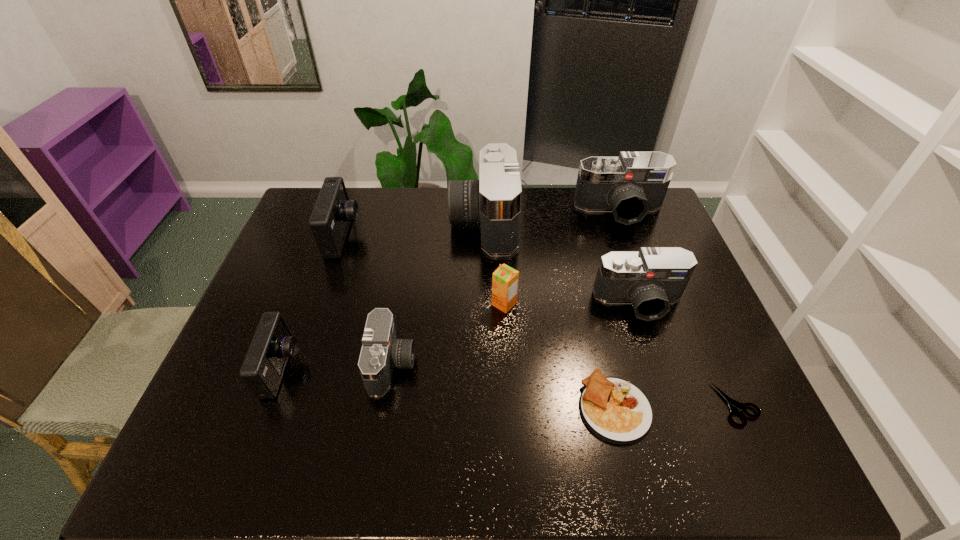
Locate an element on the screen. vacant region located 0.110m on the front-facing side of the fourth camera from right to left is located at coordinates (459, 364).

Image resolution: width=960 pixels, height=540 pixels. In order to click on vacant area situated on the back of the second shortest object in this screenshot , I will do `click(601, 349)`.

You are a GUI agent. You are given a task and a screenshot of the screen. Output one action in this format:
    pyautogui.click(x=<x>, y=<y>)
    Task: Click on the vacant space positioned 0.360m on the left of the shortest object
    This screenshot has height=540, width=960.
    Given the screenshot: What is the action you would take?
    pyautogui.click(x=562, y=404)

You are a GUI agent. You are given a task and a screenshot of the screen. Output one action in this format:
    pyautogui.click(x=<x>, y=<y>)
    Task: Click on the object present at the near edge
    The image size is (960, 540).
    Given the screenshot: What is the action you would take?
    pyautogui.click(x=614, y=409)

Image resolution: width=960 pixels, height=540 pixels. Identify the location of shears at the right edge. (734, 405).

At what (x,y) coordinates should I click in order to perform the action: click on object located at the far left corner. Please return your answer as a coordinate pair (x, y). Looking at the image, I should click on (330, 219).

Where is `object positioned at the far right corner`? object positioned at the far right corner is located at coordinates (634, 183).

Where is `vacant area at the far edge`? The width and height of the screenshot is (960, 540). vacant area at the far edge is located at coordinates (598, 226).

Locate an element on the screen. This screenshot has height=540, width=960. blank area at the near edge is located at coordinates (632, 456).

I want to click on vacant space at the right edge of the desktop, so click(x=696, y=280).